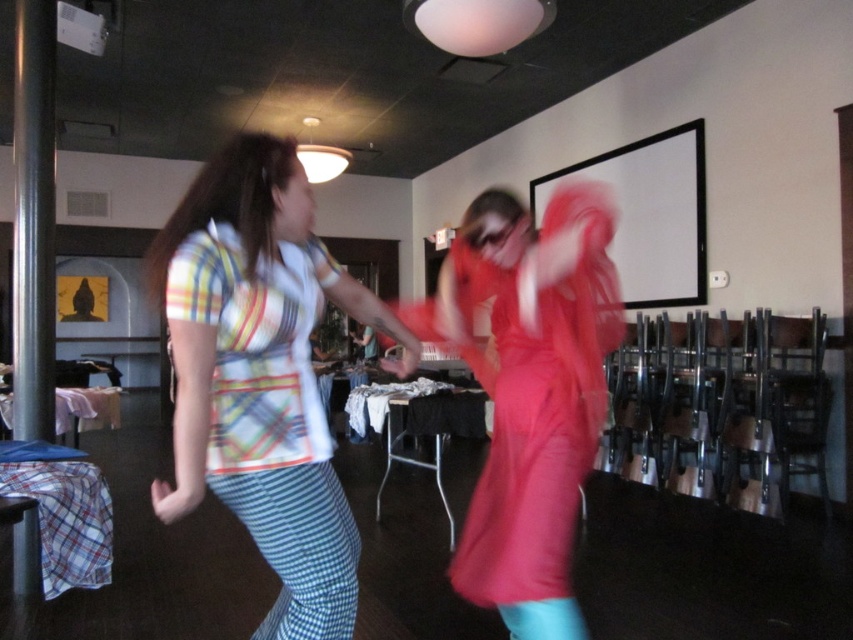
Who is lower down, striped cotton shirt at center or matte pink dress at center?

matte pink dress at center

Can you confirm if striped cotton shirt at center is bigger than matte pink dress at center?

Yes, striped cotton shirt at center is bigger than matte pink dress at center.

Between point (215, 332) and point (467, 353), which one is positioned in front?

Point (215, 332) is in front.

You are a GUI agent. You are given a task and a screenshot of the screen. Output one action in this format:
    pyautogui.click(x=<x>, y=<y>)
    Task: Click on the striped cotton shirt at center
    
    Given the screenshot: What is the action you would take?
    pyautogui.click(x=262, y=374)